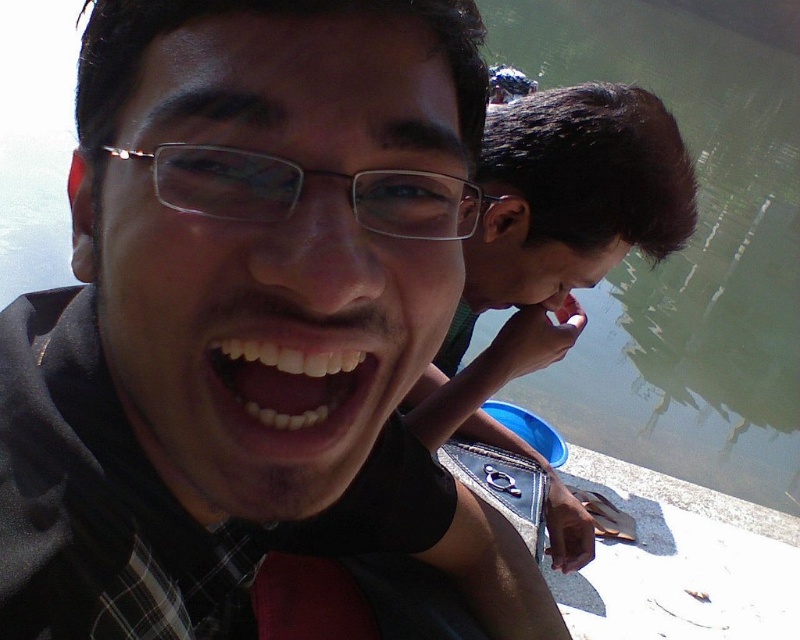
Question: Among these objects, which one is nearest to the camera?

Choices:
 (A) white glossy teeth at center
 (B) greenish water at upper right
 (C) clear plastic glasses at center

Answer: (C)

Question: Which object is closer to the camera taking this photo?

Choices:
 (A) white glossy teeth at center
 (B) clear plastic glasses at center
 (C) matte black jacket at center

Answer: (C)

Question: Does greenish water at upper right have a smaller size compared to white glossy teeth at center?

Choices:
 (A) yes
 (B) no

Answer: (B)

Question: Which object is closer to the camera taking this photo?

Choices:
 (A) matte black jacket at center
 (B) white glossy teeth at center
 (C) greenish water at upper right

Answer: (A)

Question: Is greenish water at upper right bigger than clear plastic glasses at center?

Choices:
 (A) yes
 (B) no

Answer: (A)

Question: Is white glossy teeth at center wider than clear plastic glasses at center?

Choices:
 (A) yes
 (B) no

Answer: (B)